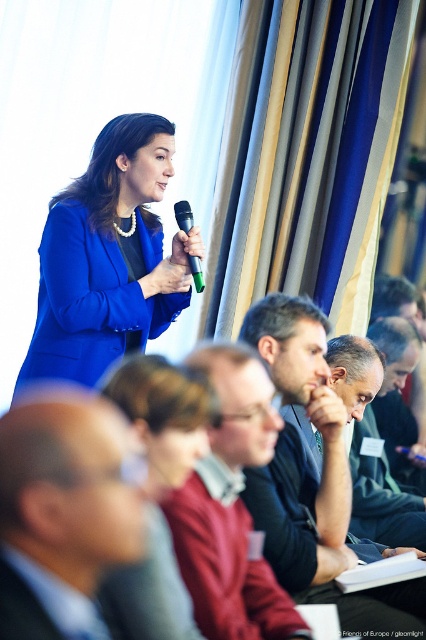
What do you see at coordinates (109, 257) in the screenshot?
I see `matte blue suit at center` at bounding box center [109, 257].

Who is taller, matte blue suit at center or green plastic microphone at upper center?

matte blue suit at center is taller.

The image size is (426, 640). What do you see at coordinates (109, 257) in the screenshot?
I see `matte blue suit at center` at bounding box center [109, 257].

Find the location of a particular element. matte blue suit at center is located at coordinates coord(109,257).

Is matte blue suit at upper left bigger than green plastic microphone at upper center?

Correct, matte blue suit at upper left is larger in size than green plastic microphone at upper center.

Is the position of matte blue suit at upper left more distant than that of green plastic microphone at upper center?

No, it is not.

Is point (158, 458) more distant than point (183, 230)?

No, (158, 458) is in front of (183, 230).

Locate an element on the screen. The width and height of the screenshot is (426, 640). matte blue suit at upper left is located at coordinates (157, 493).

In the scene shown: Between matte blue suit at center and dark blue fabric business suit at lower left, which one has more height?

matte blue suit at center

Is matte blue suit at center taller than dark blue fabric business suit at lower left?

Indeed, matte blue suit at center has a greater height compared to dark blue fabric business suit at lower left.

Is point (149, 172) positioned before point (31, 605)?

No, (149, 172) is further to viewer.

The image size is (426, 640). In order to click on matte blue suit at center in this screenshot , I will do `click(109, 257)`.